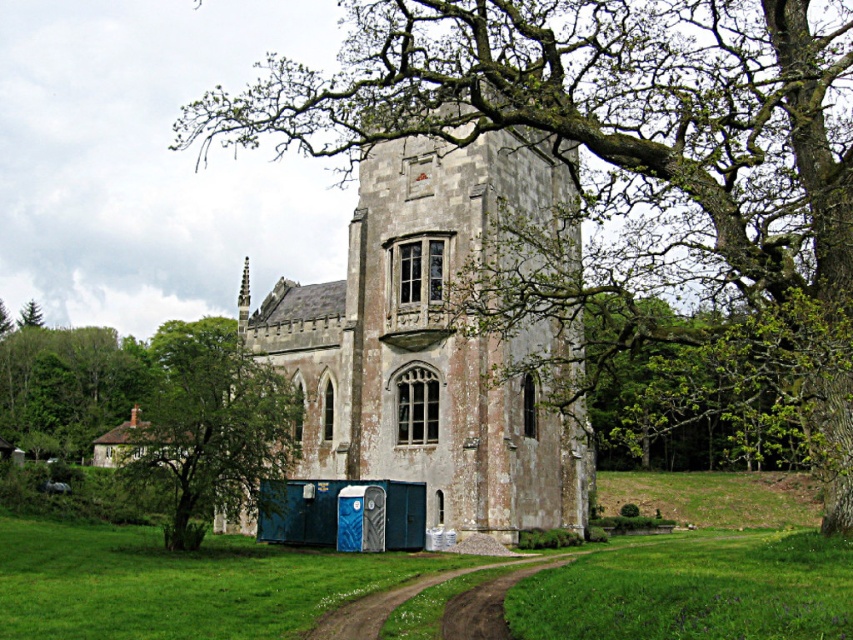
Question: Is smooth bark tree at center wider than green grassy at lower left?

Choices:
 (A) no
 (B) yes

Answer: (B)

Question: Among these objects, which one is farthest from the camera?

Choices:
 (A) green grassy field at lower right
 (B) smooth bark tree at center
 (C) green grassy at lower left

Answer: (B)

Question: Is the position of smooth bark tree at center less distant than that of green grassy at lower left?

Choices:
 (A) yes
 (B) no

Answer: (B)

Question: Which point is farther to the camera?

Choices:
 (A) green leafy tree at center
 (B) smooth bark tree at center

Answer: (A)

Question: Is smooth bark tree at center thinner than stone church at center?

Choices:
 (A) no
 (B) yes

Answer: (A)

Question: Which point is farther to the camera?

Choices:
 (A) stone church at center
 (B) green grassy field at lower right
 (C) green leafy tree at center
 (D) green grassy at lower left

Answer: (C)